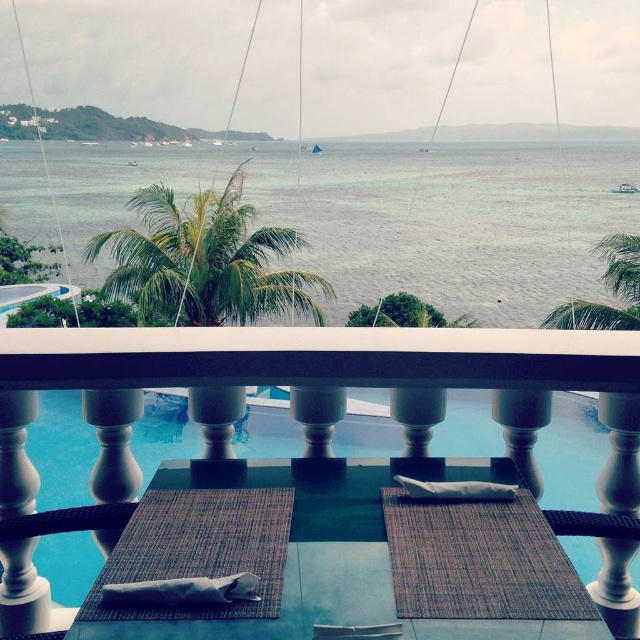
Question: Which of the following is the farthest from the observer?

Choices:
 (A) (520, 588)
 (B) (22, 218)

Answer: (B)

Question: Where is white matte table at center located in relation to bamboo placemat at center in the image?

Choices:
 (A) below
 (B) above

Answer: (A)

Question: Can you confirm if white matte table at center is thinner than bamboo placemat at center?

Choices:
 (A) no
 (B) yes

Answer: (A)

Question: Which point is closer to the camera?

Choices:
 (A) white matte table at center
 (B) bamboo placemat at center

Answer: (B)

Question: Which object is positioned closest to the white matte table at center?

Choices:
 (A) bamboo placemat at center
 (B) greenish-blue water at center

Answer: (A)

Question: Is greenish-blue water at center wider than bamboo placemat at center?

Choices:
 (A) yes
 (B) no

Answer: (A)